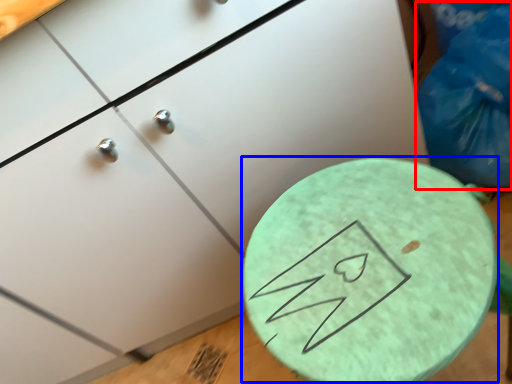
Question: Which of the following is the closest to the observer, garbage (highlighted by a red box) or round table (highlighted by a blue box)?

Choices:
 (A) garbage
 (B) round table

Answer: (B)